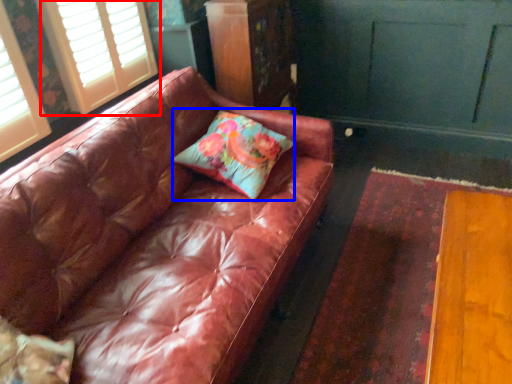
Question: Which point is closer to the camera, window (highlighted by a red box) or pillow (highlighted by a blue box)?

Choices:
 (A) window
 (B) pillow

Answer: (B)